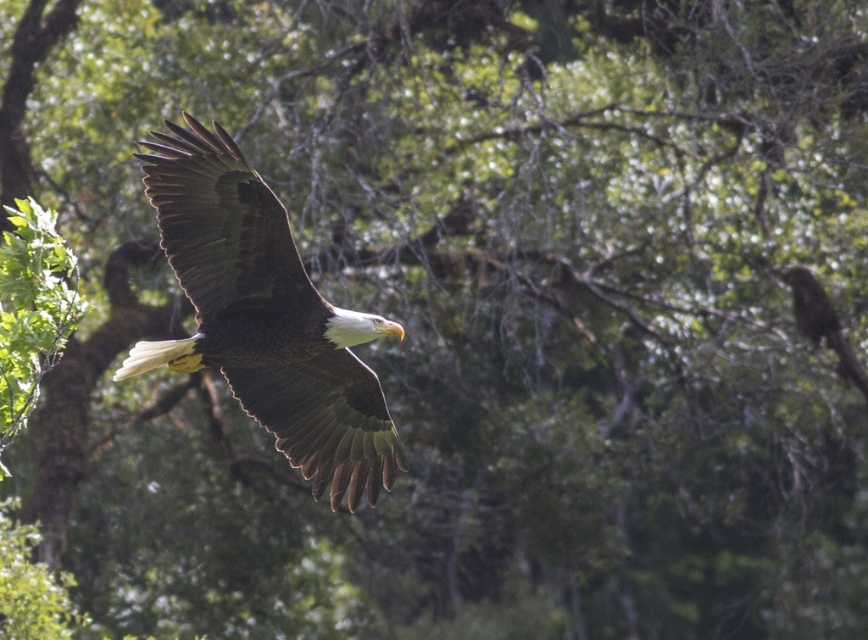
Question: Is dark brown feathers at center smaller than brown textured bird at right?

Choices:
 (A) yes
 (B) no

Answer: (A)

Question: Which object appears farthest from the camera in this image?

Choices:
 (A) brown textured bird at right
 (B) dark brown feathers at center

Answer: (A)

Question: Does dark brown feathers at center appear on the left side of brown textured bird at right?

Choices:
 (A) yes
 (B) no

Answer: (A)

Question: Does dark brown feathers at center come behind brown textured bird at right?

Choices:
 (A) yes
 (B) no

Answer: (B)

Question: Which object appears closest to the camera in this image?

Choices:
 (A) brown textured bird at right
 (B) dark brown feathers at center

Answer: (B)

Question: Among these objects, which one is nearest to the camera?

Choices:
 (A) brown textured bird at right
 (B) dark brown feathers at center

Answer: (B)